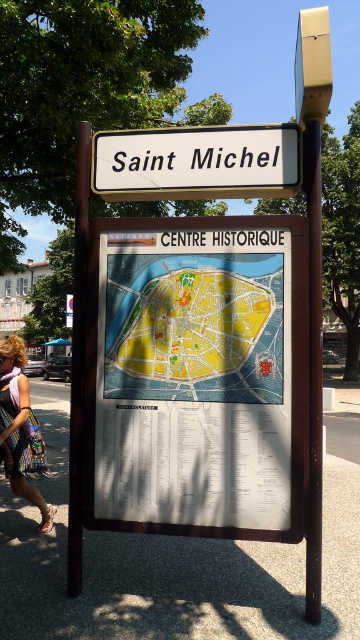
You are standing in front of the signpost described in the scene. You need to locate the yellow paper map at center and the brown wooden pole at left. Based on their positions, which object is closer to your right side?

The yellow paper map at center is to the right of brown wooden pole at left, so the yellow paper map at center is closer to your right side.

You are standing in front of the signpost described. The white paper map at center is crucial for navigating the historical district. Based on its position, can you determine if the map is placed above or below the top sign labeled Saint Michel?

The white paper map at center is located at point coordinates which would be below the top sign labeled Saint Michel since the top sign is mentioned above the larger board containing the map in the scene description.